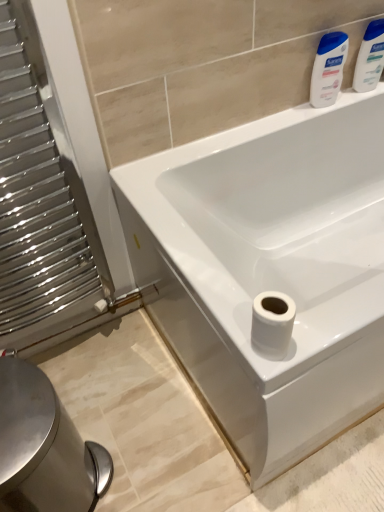
The width and height of the screenshot is (384, 512). Describe the element at coordinates (272, 323) in the screenshot. I see `white matte toilet paper at lower right` at that location.

What do you see at coordinates (36, 210) in the screenshot?
I see `polished metal radiator at left` at bounding box center [36, 210].

The height and width of the screenshot is (512, 384). I want to click on blue plastic bottles at upper right, acting as the second cleaning product starting from the left, so (x=370, y=58).

Identify the location of silver metallic bidet at lower left. This screenshot has width=384, height=512. (44, 447).

Considering the sizes of objects white glossy bathtub at center and silver metallic bidet at lower left in the image provided, who is bigger, white glossy bathtub at center or silver metallic bidet at lower left?

white glossy bathtub at center.

In terms of width, does white glossy bathtub at center look wider or thinner when compared to silver metallic bidet at lower left?

In the image, white glossy bathtub at center appears to be wider than silver metallic bidet at lower left.

Does white glossy bathtub at center have a greater height compared to silver metallic bidet at lower left?

Yes.

Could you tell me if white glossy bathtub at center is facing silver metallic bidet at lower left?

No, white glossy bathtub at center is not turned towards silver metallic bidet at lower left.

Considering the relative sizes of white glossy bathtub at center and polished metal radiator at left in the image provided, is white glossy bathtub at center thinner than polished metal radiator at left?

No.

From a real-world perspective, is white glossy bathtub at center located higher than polished metal radiator at left?

No, from a real-world perspective, white glossy bathtub at center is not above polished metal radiator at left.

Find the location of a particular element. bathtub that appears below the polished metal radiator at left (from a real-world perspective) is located at coordinates (270, 269).

How different are the orientations of white glossy bathtub at center and polished metal radiator at left in degrees?

The facing directions of white glossy bathtub at center and polished metal radiator at left are 0.307 degrees apart.

Is white glossy bathtub at center located within blue plastic bottles at upper right, acting as the second cleaning product starting from the left?

No.

Which object is further away from the camera taking this photo, blue plastic bottles at upper right, positioned as the 1th cleaning product in right-to-left order, or white glossy bathtub at center?

blue plastic bottles at upper right, positioned as the 1th cleaning product in right-to-left order, is more distant.

Can you confirm if blue plastic bottles at upper right, acting as the second cleaning product starting from the left, is taller than white glossy bathtub at center?

Incorrect, the height of blue plastic bottles at upper right, acting as the second cleaning product starting from the left, is not larger of that of white glossy bathtub at center.

Which is in front, point (288, 297) or point (318, 59)?

The point (318, 59) is closer to the camera.

In the scene shown: Does white matte toilet paper at lower right contain white glossy lotion at upper right, positioned as the 2th cleaning product in right-to-left order?

No, white glossy lotion at upper right, positioned as the 2th cleaning product in right-to-left order, is not a part of white matte toilet paper at lower right.

Looking at their sizes, would you say white matte toilet paper at lower right is wider or thinner than white glossy lotion at upper right, which is counted as the 1th cleaning product, starting from the left?

Clearly, white matte toilet paper at lower right has more width compared to white glossy lotion at upper right, which is counted as the 1th cleaning product, starting from the left.

Which is correct: white glossy bathtub at center is inside blue plastic bottles at upper right, acting as the second cleaning product starting from the left, or outside of it?

white glossy bathtub at center is outside blue plastic bottles at upper right, acting as the second cleaning product starting from the left.

Is white glossy bathtub at center closer to camera compared to blue plastic bottles at upper right, positioned as the 1th cleaning product in right-to-left order?

Yes, it is in front of blue plastic bottles at upper right, positioned as the 1th cleaning product in right-to-left order.

Does white glossy bathtub at center have a smaller size compared to blue plastic bottles at upper right, positioned as the 1th cleaning product in right-to-left order?

Incorrect, white glossy bathtub at center is not smaller in size than blue plastic bottles at upper right, positioned as the 1th cleaning product in right-to-left order.

From a real-world perspective, is white glossy bathtub at center positioned over blue plastic bottles at upper right, positioned as the 1th cleaning product in right-to-left order, based on gravity?

No, from a real-world perspective, white glossy bathtub at center is not over blue plastic bottles at upper right, positioned as the 1th cleaning product in right-to-left order

Locate an element on the screen. The height and width of the screenshot is (512, 384). bathtub behind the white matte toilet paper at lower right is located at coordinates (270, 269).

Is white glossy bathtub at center not within white matte toilet paper at lower right?

Yes, white glossy bathtub at center is not within white matte toilet paper at lower right.

Based on the photo, can you see white glossy bathtub at center touching white matte toilet paper at lower right?

white glossy bathtub at center and white matte toilet paper at lower right are clearly separated.

From the image's perspective, would you say white glossy bathtub at center is positioned over white matte toilet paper at lower right?

Correct, white glossy bathtub at center appears higher than white matte toilet paper at lower right in the image.

Which of these two, polished metal radiator at left or white matte toilet paper at lower right, is thinner?

white matte toilet paper at lower right is thinner.

How different are the orientations of polished metal radiator at left and white matte toilet paper at lower right in degrees?

The facing directions of polished metal radiator at left and white matte toilet paper at lower right are 0.271 degrees apart.

Is polished metal radiator at left oriented towards white matte toilet paper at lower right?

No, polished metal radiator at left is not turned towards white matte toilet paper at lower right.

From the image's perspective, would you say polished metal radiator at left is shown under white matte toilet paper at lower right?

No.

Find the location of a particular element. bidet on the left of white glossy bathtub at center is located at coordinates (44, 447).

What are the coordinates of `bathtub behind the polished metal radiator at left` in the screenshot? It's located at (270, 269).

When comparing their distances from blue plastic bottles at upper right, positioned as the 1th cleaning product in right-to-left order, does polished metal radiator at left or white matte toilet paper at lower right seem further?

polished metal radiator at left.

Based on their spatial positions, is white glossy bathtub at center or silver metallic bidet at lower left closer to polished metal radiator at left?

silver metallic bidet at lower left lies closer to polished metal radiator at left than the other object.

When comparing their distances from white matte toilet paper at lower right, does blue plastic bottles at upper right, positioned as the 1th cleaning product in right-to-left order, or white glossy bathtub at center seem closer?

white glossy bathtub at center.

From the image, which object appears to be farther from white matte toilet paper at lower right, polished metal radiator at left or white glossy bathtub at center?

The object further to white matte toilet paper at lower right is polished metal radiator at left.

From the image, which object appears to be farther from white glossy lotion at upper right, which is counted as the 1th cleaning product, starting from the left, white glossy bathtub at center or white matte toilet paper at lower right?

Among the two, white matte toilet paper at lower right is located further to white glossy lotion at upper right, which is counted as the 1th cleaning product, starting from the left.

Looking at this image, based on their spatial positions, is white matte toilet paper at lower right or polished metal radiator at left further from silver metallic bidet at lower left?

white matte toilet paper at lower right is positioned further to the anchor silver metallic bidet at lower left.

Looking at the image, which one is located further to white glossy bathtub at center, white glossy lotion at upper right, which is counted as the 1th cleaning product, starting from the left, or silver metallic bidet at lower left?

Based on the image, silver metallic bidet at lower left appears to be further to white glossy bathtub at center.

Looking at the image, which one is located further to silver metallic bidet at lower left, blue plastic bottles at upper right, positioned as the 1th cleaning product in right-to-left order, or white glossy bathtub at center?

blue plastic bottles at upper right, positioned as the 1th cleaning product in right-to-left order, is further to silver metallic bidet at lower left.

Find the location of a particular element. bathtub between white glossy lotion at upper right, positioned as the 2th cleaning product in right-to-left order, and white matte toilet paper at lower right in the up-down direction is located at coordinates (270, 269).

Identify the location of toilet paper between polished metal radiator at left and white glossy bathtub at center from left to right. This screenshot has height=512, width=384. (272, 323).

Where is `toilet paper situated between silver metallic bidet at lower left and white glossy bathtub at center from left to right`? The height and width of the screenshot is (512, 384). toilet paper situated between silver metallic bidet at lower left and white glossy bathtub at center from left to right is located at coordinates (272, 323).

Locate an element on the screen. The height and width of the screenshot is (512, 384). cleaning product located between polished metal radiator at left and blue plastic bottles at upper right, acting as the second cleaning product starting from the left, in the left-right direction is located at coordinates (328, 69).